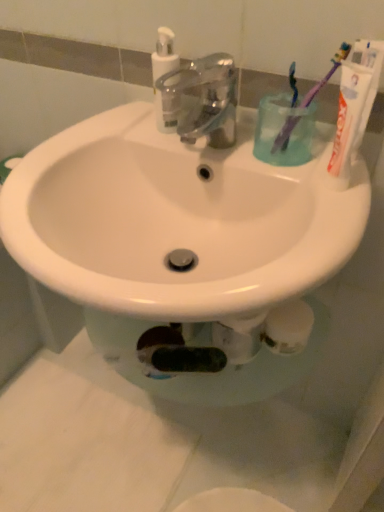
Question: From the image's perspective, is white glossy sink at center located above or below translucent plastic cup at upper right?

Choices:
 (A) above
 (B) below

Answer: (B)

Question: Considering the positions of white glossy sink at center and translucent plastic cup at upper right in the image, is white glossy sink at center wider or thinner than translucent plastic cup at upper right?

Choices:
 (A) thin
 (B) wide

Answer: (B)

Question: Which is farther from the white matte toothpaste at upper right?

Choices:
 (A) purple plastic toothbrush at upper right, acting as the 2th toothbrush starting from the left
 (B) translucent plastic pump bottle at upper center
 (C) translucent plastic cup at upper right
 (D) purple plastic toothbrush at upper right, which is the first toothbrush from left to right
 (E) white glossy sink at center

Answer: (B)

Question: Which is farther from the translucent plastic cup at upper right?

Choices:
 (A) purple plastic toothbrush at upper right, which is the first toothbrush from left to right
 (B) white matte toothpaste at upper right
 (C) purple plastic toothbrush at upper right, which is the first toothbrush from right to left
 (D) metallic faucet at center
 (E) translucent plastic pump bottle at upper center

Answer: (E)